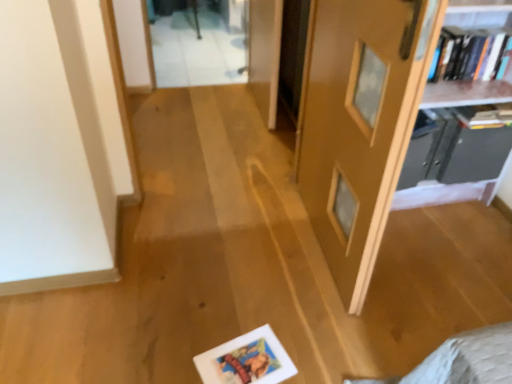
The image size is (512, 384). Identify the location of vacant space that is to the left of matte wooden door at center. (224, 247).